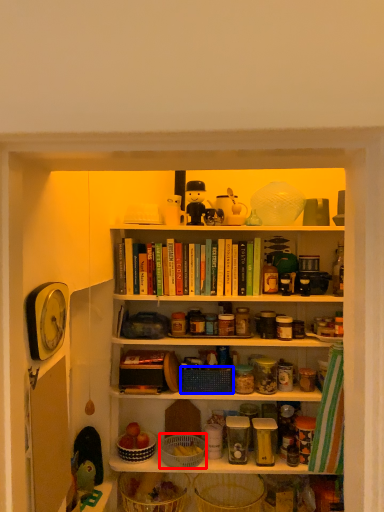
Question: Which object is closer to the camera taking this photo, basket (highlighted by a red box) or basket (highlighted by a blue box)?

Choices:
 (A) basket
 (B) basket

Answer: (A)